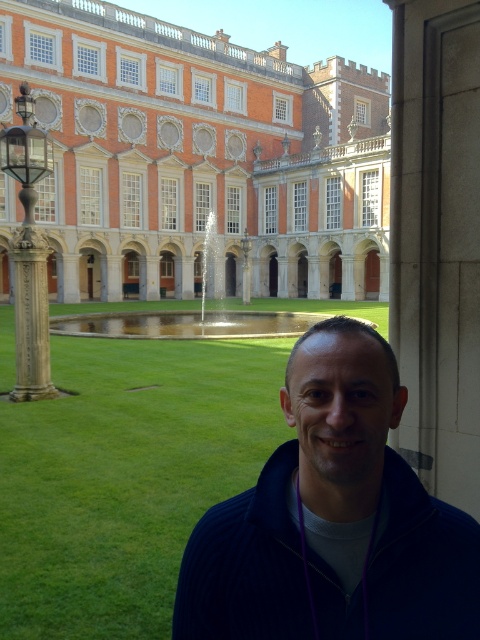
Is point (100, 435) positioned in front of point (345, 394)?

No.

Does green grass at lower center appear under dark blue sweater at lower right?

No.

Image resolution: width=480 pixels, height=640 pixels. Find the location of `green grass at lower center`. green grass at lower center is located at coordinates (126, 477).

Find the location of a particular element. green grass at lower center is located at coordinates coord(126,477).

Who is taller, orange brick building at center or green grass at lower center?

With more height is orange brick building at center.

Can you confirm if orange brick building at center is positioned above green grass at lower center?

Yes, orange brick building at center is above green grass at lower center.

Which is behind, point (56, 221) or point (17, 442)?

The point (56, 221) is more distant.

Find the location of a particular element. orange brick building at center is located at coordinates (197, 156).

Is orange brick building at center positioned in front of dark blue sweater at lower right?

No, orange brick building at center is further to the viewer.

Can you confirm if orange brick building at center is positioned to the right of dark blue sweater at lower right?

Indeed, orange brick building at center is positioned on the right side of dark blue sweater at lower right.

Which is in front, point (170, 138) or point (292, 458)?

Point (292, 458) is in front.

Find the location of a particular element. This screenshot has height=640, width=480. orange brick building at center is located at coordinates (197, 156).